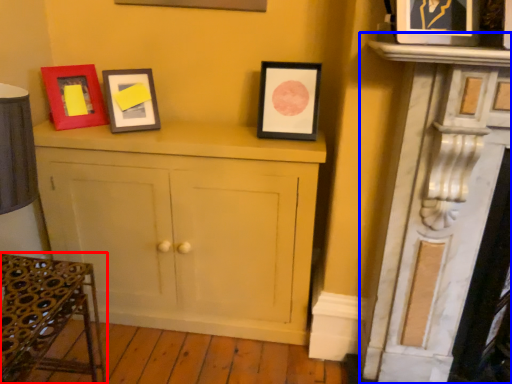
Question: Which object is further to the camera taking this photo, furniture (highlighted by a red box) or fireplace (highlighted by a blue box)?

Choices:
 (A) furniture
 (B) fireplace

Answer: (B)